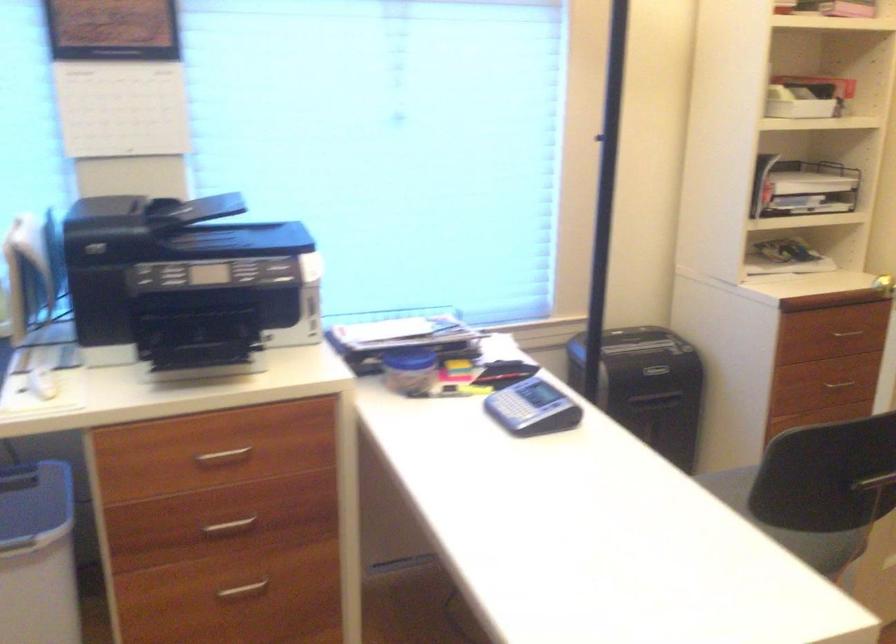
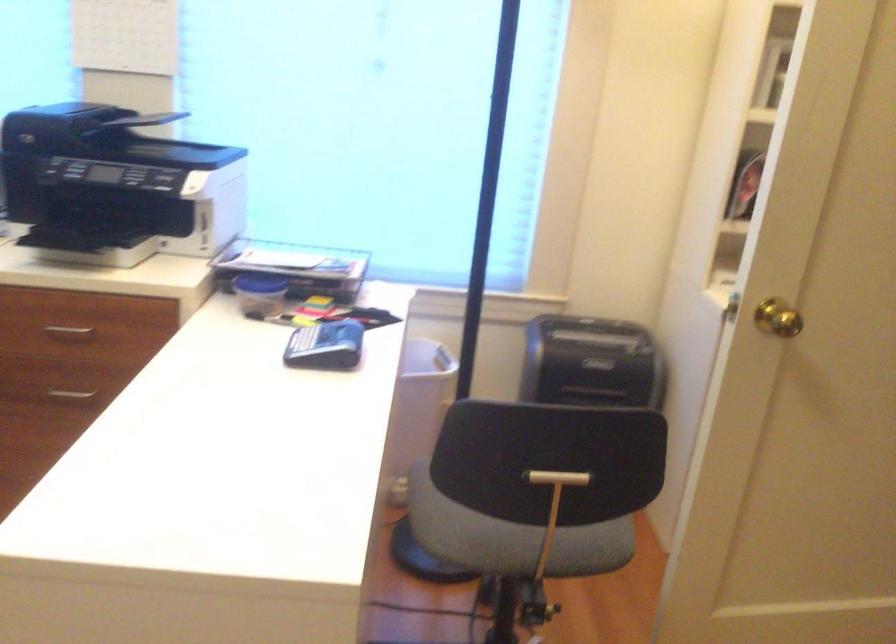
Find the pixel in the second image that matches (x=655, y=368) in the first image.

(590, 363)